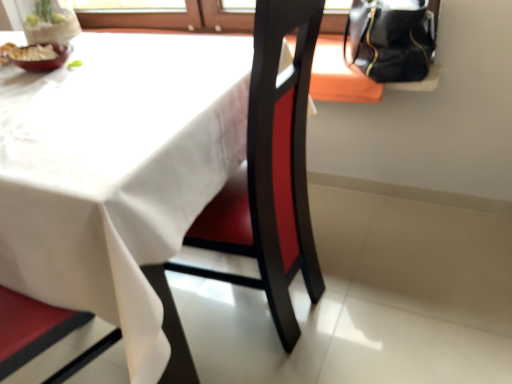
Question: Looking at the image, does black leather handbag at upper right seem bigger or smaller compared to white matte table at center?

Choices:
 (A) big
 (B) small

Answer: (B)

Question: From a real-world perspective, is black leather handbag at upper right physically located above or below white matte table at center?

Choices:
 (A) above
 (B) below

Answer: (A)

Question: Estimate the real-world distances between objects in this image. Which object is farther from the white matte table at center?

Choices:
 (A) matte ceramic bowl at upper left
 (B) black leather handbag at upper right

Answer: (B)

Question: Estimate the real-world distances between objects in this image. Which object is farther from the black leather handbag at upper right?

Choices:
 (A) white matte table at center
 (B) matte ceramic bowl at upper left

Answer: (B)